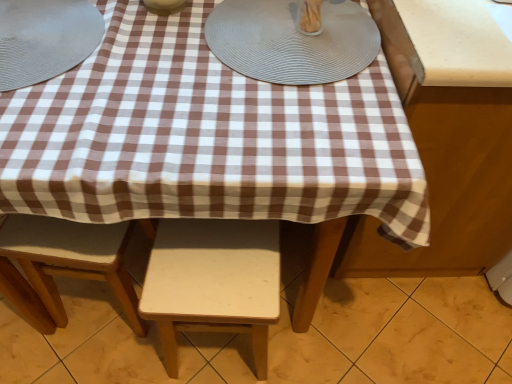
You are a GUI agent. You are given a task and a screenshot of the screen. Output one action in this format:
    pyautogui.click(x=<x>, y=<y>)
    Task: Click on the free space to the back side of clear glass container at upper center, placed as the first tableware when sorted from right to left
    Image resolution: width=512 pixels, height=384 pixels.
    Given the screenshot: What is the action you would take?
    pyautogui.click(x=303, y=8)